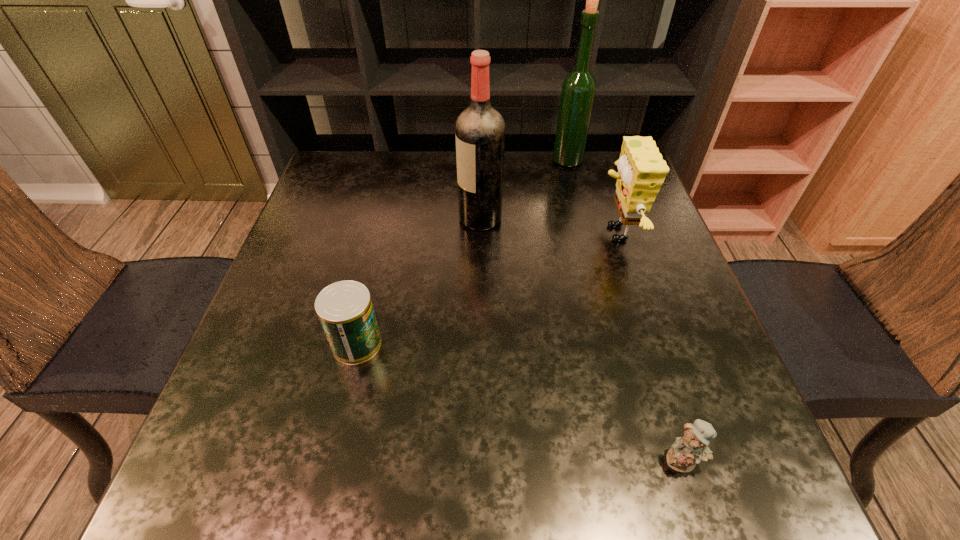
You are a GUI agent. You are given a task and a screenshot of the screen. Output one action in this format:
    pyautogui.click(x=<x>, y=<y>)
    Task: Click on the vacant area situated on the front-facing side of the second object from left to right
    
    Given the screenshot: What is the action you would take?
    431,219

I want to click on vacant space located on the front-facing side of the second object from left to right, so click(371, 219).

You are a GUI agent. You are given a task and a screenshot of the screen. Output one action in this format:
    pyautogui.click(x=<x>, y=<y>)
    Task: Click on the vacant space situated 0.230m on the front-facing side of the second object from left to right
    Image resolution: width=960 pixels, height=540 pixels.
    Given the screenshot: What is the action you would take?
    pyautogui.click(x=367, y=219)

The height and width of the screenshot is (540, 960). What are the coordinates of `vacant space located 0.310m on the front-facing side of the sponge` in the screenshot? It's located at (465, 233).

At what (x,y) coordinates should I click in order to perform the action: click on vacant space located 0.300m on the front-facing side of the sponge. Please return your answer as a coordinate pair (x, y). Looking at the image, I should click on (468, 233).

At what (x,y) coordinates should I click in order to perform the action: click on free location located 0.390m on the front-facing side of the sponge. Please return your answer as a coordinate pair (x, y). Image resolution: width=960 pixels, height=540 pixels. Looking at the image, I should click on 431,233.

In order to click on free region located 0.200m on the front of the can in this screenshot , I will do `click(325, 478)`.

What are the coordinates of `object that is positioned at the far edge` in the screenshot? It's located at (578, 90).

Identify the location of object that is at the near edge. This screenshot has height=540, width=960. (692, 448).

At what (x,y) coordinates should I click in order to perform the action: click on liquor at the right edge. Please return your answer as a coordinate pair (x, y). This screenshot has width=960, height=540. Looking at the image, I should click on (578, 90).